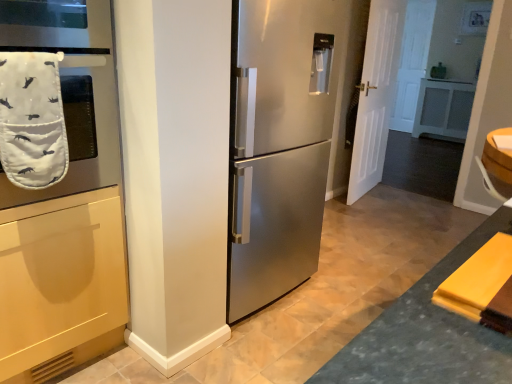
You are a GUI agent. You are given a task and a screenshot of the screen. Output one action in this format:
    pyautogui.click(x=<x>, y=<y>)
    Task: Click on the free space in front of white matte door at right
    Image resolution: width=512 pixels, height=384 pixels.
    Given the screenshot: What is the action you would take?
    pyautogui.click(x=375, y=213)